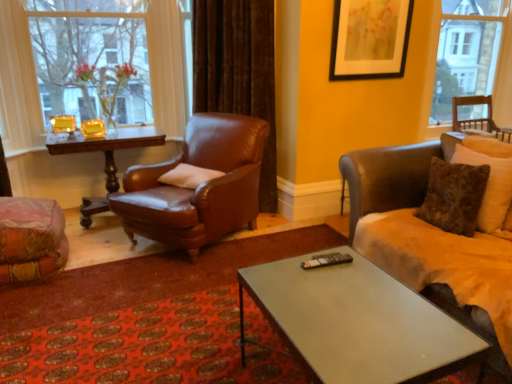
Question: From a real-world perspective, is white soft pillow at center located higher than matte black picture frame at upper center?

Choices:
 (A) no
 (B) yes

Answer: (A)

Question: Is white soft pillow at center positioned in front of matte black picture frame at upper center?

Choices:
 (A) no
 (B) yes

Answer: (B)

Question: Is white soft pillow at center shorter than matte black picture frame at upper center?

Choices:
 (A) yes
 (B) no

Answer: (A)

Question: Is white soft pillow at center completely or partially outside of matte black picture frame at upper center?

Choices:
 (A) yes
 (B) no

Answer: (A)

Question: Does white soft pillow at center have a lesser width compared to matte black picture frame at upper center?

Choices:
 (A) yes
 (B) no

Answer: (B)

Question: Visually, is white soft pillow at center positioned to the left or to the right of brown leather couch at right, which is counted as the third chair, starting from the left?

Choices:
 (A) right
 (B) left

Answer: (B)

Question: From a real-world perspective, is white soft pillow at center positioned above or below brown leather couch at right, the 2th chair viewed from the right?

Choices:
 (A) above
 (B) below

Answer: (A)

Question: Which is correct: white soft pillow at center is inside brown leather couch at right, which is counted as the third chair, starting from the left, or outside of it?

Choices:
 (A) outside
 (B) inside

Answer: (A)

Question: Considering their positions, is white soft pillow at center located in front of or behind brown leather couch at right, which is counted as the third chair, starting from the left?

Choices:
 (A) behind
 (B) front

Answer: (A)

Question: From a real-world perspective, is wooden polished table at left above or below metallic gray coffee table at center?

Choices:
 (A) below
 (B) above

Answer: (B)

Question: Looking at the image, does wooden polished table at left seem bigger or smaller compared to metallic gray coffee table at center?

Choices:
 (A) big
 (B) small

Answer: (A)

Question: From their relative heights in the image, would you say wooden polished table at left is taller or shorter than metallic gray coffee table at center?

Choices:
 (A) short
 (B) tall

Answer: (B)

Question: From the image's perspective, is wooden polished table at left positioned above or below metallic gray coffee table at center?

Choices:
 (A) below
 (B) above

Answer: (B)

Question: Relative to velvet orange chair at lower left, the 4th chair when ordered from right to left, is wooden chair at right, acting as the first window starting from the right, in front or behind?

Choices:
 (A) behind
 (B) front

Answer: (A)

Question: From a real-world perspective, is wooden chair at right, acting as the first window starting from the right, physically located above or below velvet orange chair at lower left, positioned as the 1th chair in left-to-right order?

Choices:
 (A) below
 (B) above

Answer: (B)